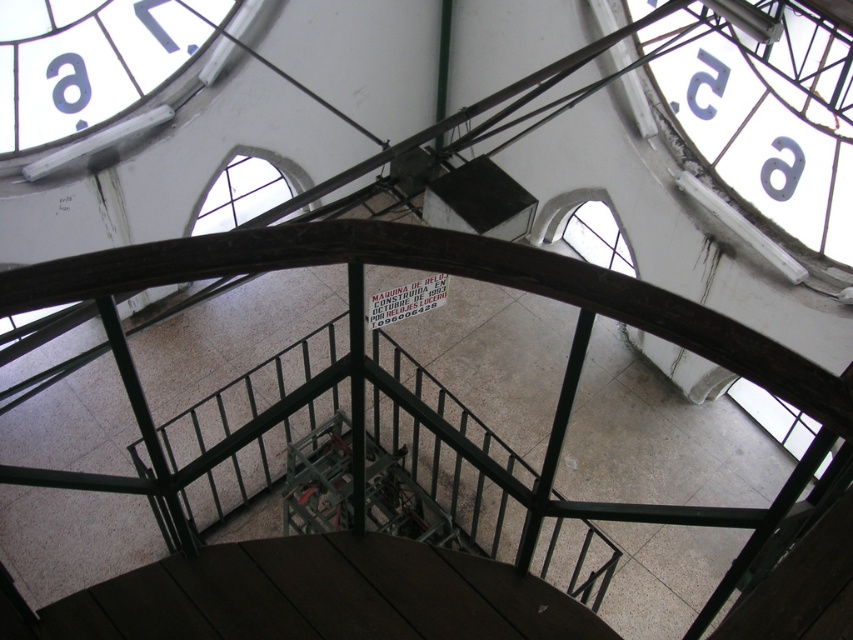
Question: Does white glossy clock at upper left come in front of black plastic number at upper right?

Choices:
 (A) yes
 (B) no

Answer: (A)

Question: Which point is closer to the camera?

Choices:
 (A) (67, 97)
 (B) (171, 51)
 (C) (755, 99)

Answer: (C)

Question: Does clear glass window at center have a greater width compared to black plastic number at upper right?

Choices:
 (A) no
 (B) yes

Answer: (B)

Question: Is gray metallic letter "a" at upper left above black matte number at upper left?

Choices:
 (A) no
 (B) yes

Answer: (A)

Question: Which point is farther from the camera taking this photo?

Choices:
 (A) (206, 195)
 (B) (618, 240)
 (C) (78, 54)
 (D) (143, 0)

Answer: (B)

Question: Which of the following is the farthest from the observer?

Choices:
 (A) (13, 32)
 (B) (833, 81)

Answer: (A)